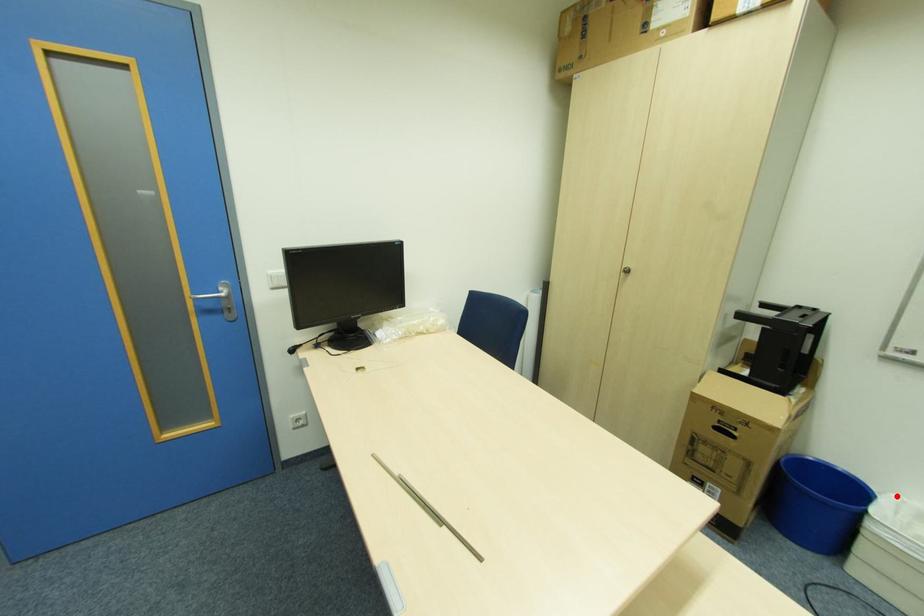
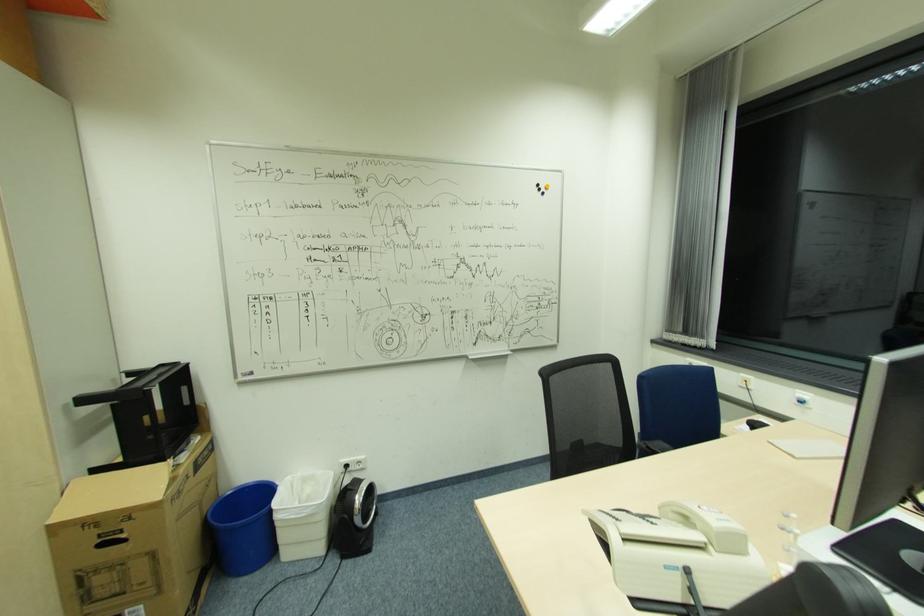
Question: I am providing you with two images of the same scene from different viewpoints. A red point is marked on the first image. Can you still see the location of the red point in image 2?

Choices:
 (A) Yes
 (B) No

Answer: (A)